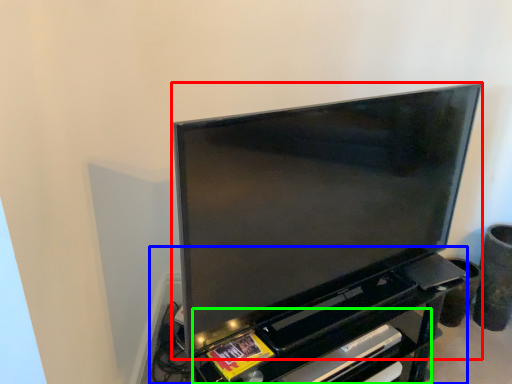
Question: Which is farther away from television (highlighted by a red box)? entertainment center (highlighted by a blue box) or shelf (highlighted by a green box)?

Choices:
 (A) entertainment center
 (B) shelf

Answer: (B)